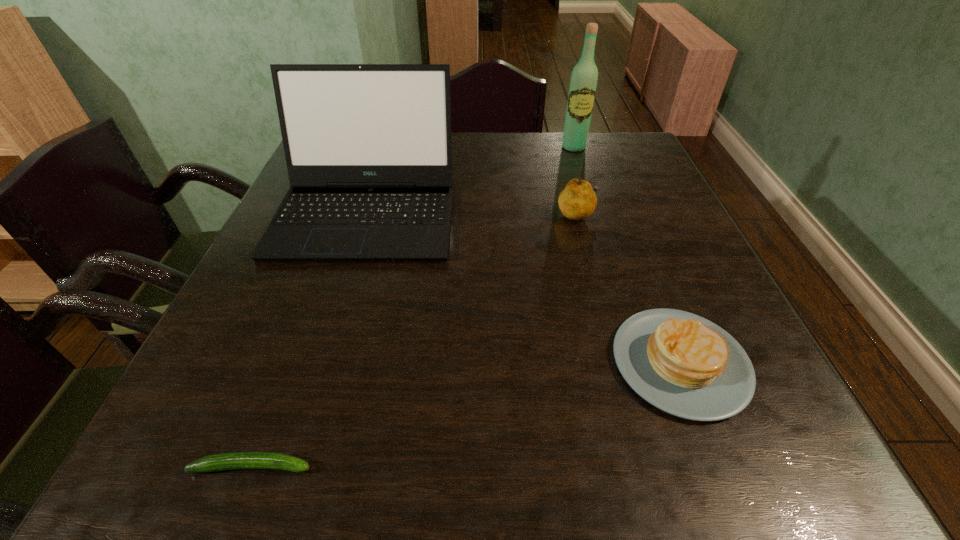
Where is `object located at the near left corner`? object located at the near left corner is located at coordinates (238, 460).

At what (x,y) coordinates should I click in order to perform the action: click on object located at the near right corner. Please return your answer as a coordinate pair (x, y). Looking at the image, I should click on (683, 364).

This screenshot has width=960, height=540. In order to click on vacant space at the far edge of the desktop in this screenshot , I will do `click(457, 139)`.

This screenshot has width=960, height=540. I want to click on free point at the near edge, so click(x=288, y=424).

Locate an element on the screen. free location at the right edge is located at coordinates (639, 187).

In the image, there is a desktop. At what (x,y) coordinates should I click in order to perform the action: click on free space at the near right corner. Please return your answer as a coordinate pair (x, y). Looking at the image, I should click on (788, 429).

Locate an element on the screen. The width and height of the screenshot is (960, 540). empty space that is in between the second tallest object and the farthest object is located at coordinates (470, 180).

In order to click on free space between the shortest object and the pear in this screenshot , I will do `click(415, 340)`.

Identify the location of unoccupied position between the shortest object and the fourth tallest object. Image resolution: width=960 pixels, height=540 pixels. (467, 414).

The height and width of the screenshot is (540, 960). In order to click on vacant area that lies between the wine bottle and the pancake in this screenshot , I will do `click(627, 255)`.